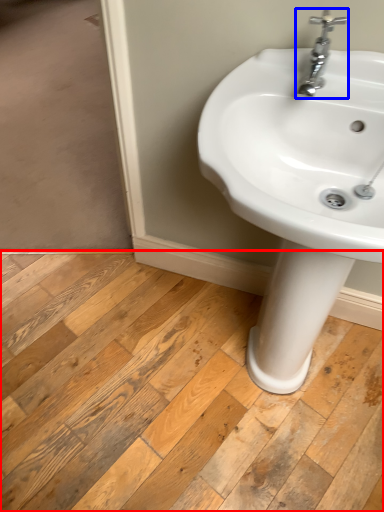
Question: Which object is further to the camera taking this photo, plank (highlighted by a red box) or tap (highlighted by a blue box)?

Choices:
 (A) plank
 (B) tap

Answer: (A)